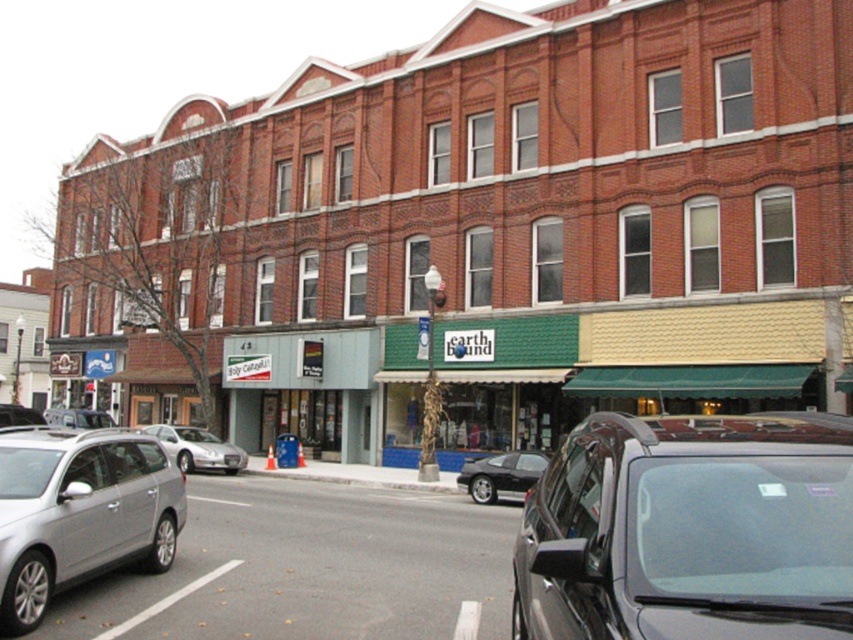
Question: Which point is farther to the camera?

Choices:
 (A) satin silver sedan at center
 (B) silver metallic car at lower left

Answer: (A)

Question: Which of the following is the closest to the observer?

Choices:
 (A) (68, 413)
 (B) (698, 452)

Answer: (B)

Question: Is silver metallic sedan at center to the right of silver metallic sedan at center-left from the viewer's perspective?

Choices:
 (A) yes
 (B) no

Answer: (A)

Question: Considering the real-world distances, which object is closest to the silver metallic sedan at center-left?

Choices:
 (A) silver metallic sedan at center
 (B) shiny black car at center
 (C) silver metallic car at lower left

Answer: (A)

Question: Is shiny black car at center to the left of silver metallic sedan at center-left from the viewer's perspective?

Choices:
 (A) yes
 (B) no

Answer: (B)

Question: Can you confirm if silver metallic car at lower left is smaller than shiny black car at center?

Choices:
 (A) no
 (B) yes

Answer: (B)